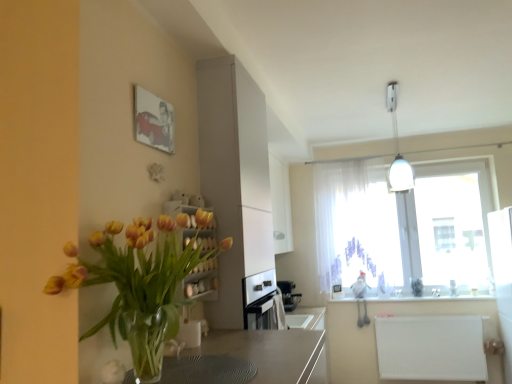
Question: Considering the positions of point pos(398,173) and point pos(350,350), is point pos(398,173) closer or farther from the camera than point pos(350,350)?

Choices:
 (A) closer
 (B) farther

Answer: (A)

Question: In the image, is white glossy light fixture at upper right on the left side or the right side of white matte radiator at lower right, the 1th counter top in the bottom-to-top sequence?

Choices:
 (A) right
 (B) left

Answer: (B)

Question: Estimate the real-world distances between objects in this image. Which object is closer to the translucent glass vase at left?

Choices:
 (A) translucent fabric at upper right
 (B) white matte radiator at lower right, the 2th counter top positioned from the top
 (C) matte canvas painting at upper left
 (D) white sheer curtain at upper right
 (E) white glossy light fixture at upper right

Answer: (C)

Question: Which of these objects is positioned farthest from the white glossy light fixture at upper right?

Choices:
 (A) white sheer curtain at upper right
 (B) matte canvas painting at upper left
 (C) translucent fabric at upper right
 (D) translucent glass vase at left
 (E) white matte radiator at lower right, the 2th counter top positioned from the top

Answer: (D)